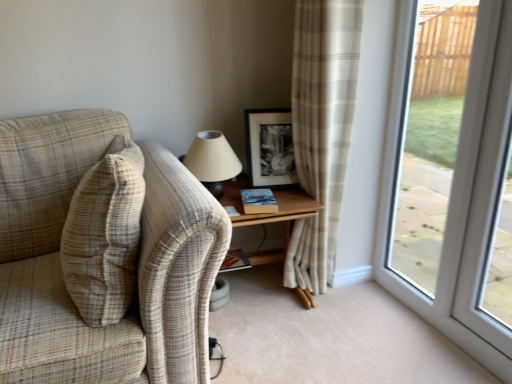
Where is `vacant point to the right of beige plaid curtain at center`? The width and height of the screenshot is (512, 384). vacant point to the right of beige plaid curtain at center is located at coordinates (368, 293).